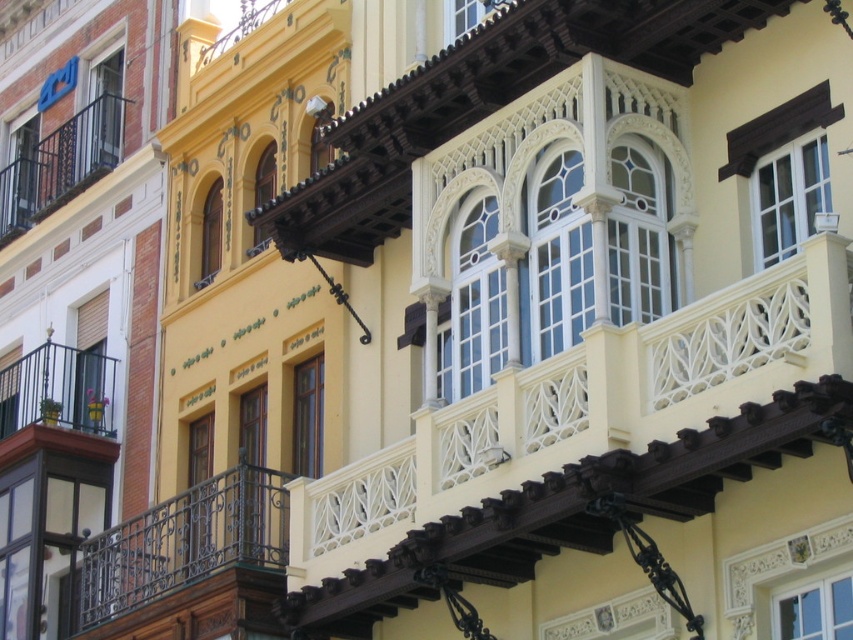
Looking at this image, is rustic wrought iron balcony at left smaller than black wrought iron balcony at left?

A: Correct, rustic wrought iron balcony at left occupies less space than black wrought iron balcony at left.

Which of these two, rustic wrought iron balcony at left or black wrought iron balcony at left, stands taller?

black wrought iron balcony at left

Between point (0, 451) and point (96, 122), which one is positioned in front?

Point (0, 451) is more forward.

In order to click on rustic wrought iron balcony at left in this screenshot , I will do `click(57, 403)`.

Is black wrought iron railing at left positioned behind rustic wrought iron balcony at left?

No, it is in front of rustic wrought iron balcony at left.

Is black wrought iron railing at left below rustic wrought iron balcony at left?

Yes, black wrought iron railing at left is below rustic wrought iron balcony at left.

Identify the location of black wrought iron railing at left. (190, 563).

Find the location of `black wrought iron railing at left`. black wrought iron railing at left is located at coordinates (190, 563).

Does black wrought iron railing at left appear over black wrought iron balcony at left?

Actually, black wrought iron railing at left is below black wrought iron balcony at left.

What are the coordinates of `black wrought iron railing at left` in the screenshot? It's located at (190, 563).

Does point (115, 532) come in front of point (67, 132)?

Yes, it is in front of point (67, 132).

You are a GUI agent. You are given a task and a screenshot of the screen. Output one action in this format:
    pyautogui.click(x=<x>, y=<y>)
    Task: Click on the black wrought iron railing at left
    This screenshot has width=853, height=640.
    Given the screenshot: What is the action you would take?
    pyautogui.click(x=190, y=563)